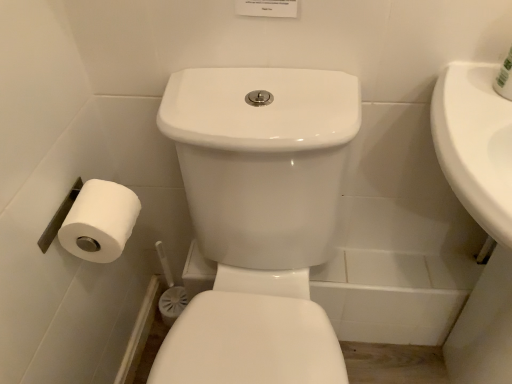
This screenshot has height=384, width=512. What do you see at coordinates (100, 221) in the screenshot? I see `white matte toilet paper at lower left` at bounding box center [100, 221].

In order to click on white matte toilet paper at lower left in this screenshot , I will do `click(100, 221)`.

What is the approximate width of white matte toilet paper at lower left?

The width of white matte toilet paper at lower left is 4.82 inches.

Find the location of a particular element. white matte toilet paper at lower left is located at coordinates (100, 221).